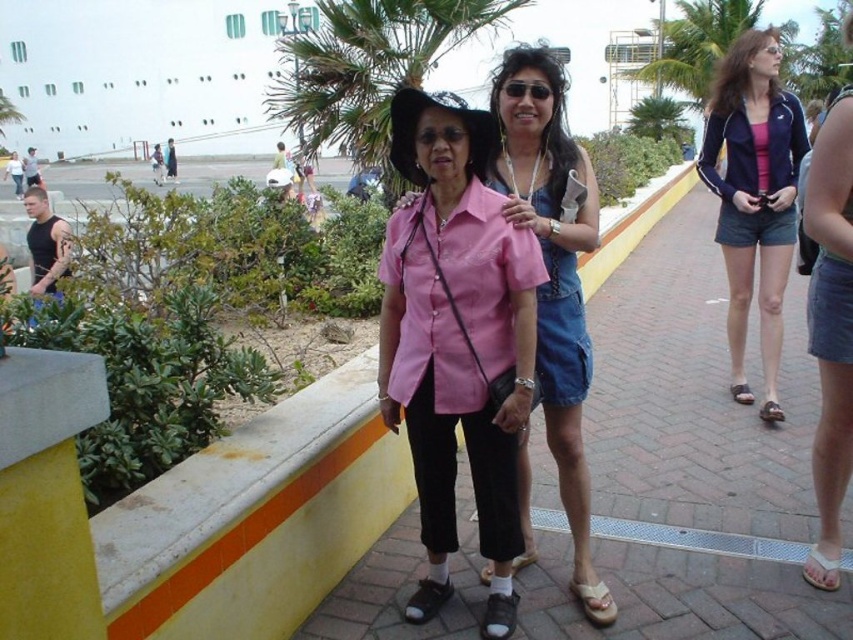
Is pink fabric shirt at center above matte black sunglasses at center?

Incorrect, pink fabric shirt at center is not positioned above matte black sunglasses at center.

Which is above, pink fabric shirt at center or matte black sunglasses at center?

Positioned higher is matte black sunglasses at center.

The height and width of the screenshot is (640, 853). In order to click on pink fabric shirt at center in this screenshot , I will do `click(686, 467)`.

In the scene shown: Who is lower down, pink matte shirt at center or matte black sunglasses at center?

pink matte shirt at center

Is point (460, 308) positioned behind point (534, 88)?

No.

The image size is (853, 640). What are the coordinates of `pink matte shirt at center` in the screenshot? It's located at pyautogui.click(x=456, y=324).

Does point (670, 396) come behind point (389, 76)?

No.

Who is shorter, pink fabric shirt at center or green leafy palm tree at upper center?

Standing shorter between the two is pink fabric shirt at center.

Describe the element at coordinates (686, 467) in the screenshot. This screenshot has width=853, height=640. I see `pink fabric shirt at center` at that location.

The width and height of the screenshot is (853, 640). I want to click on pink fabric shirt at center, so click(x=686, y=467).